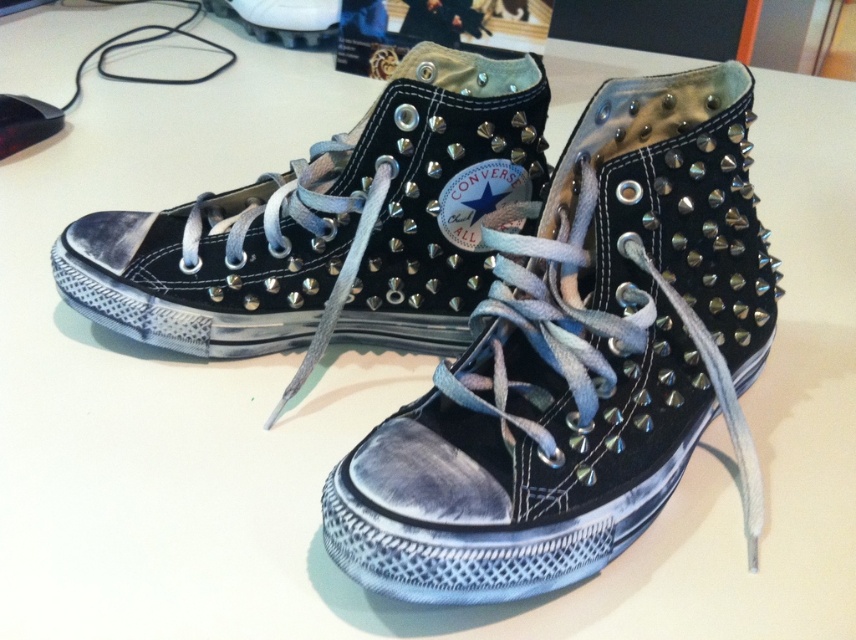
Question: Which point is closer to the camera?

Choices:
 (A) black leather converse at center
 (B) matte black sneakers at center

Answer: (A)

Question: Does black leather converse at center appear over matte black sneakers at center?

Choices:
 (A) no
 (B) yes

Answer: (A)

Question: Which of the following is the closest to the observer?

Choices:
 (A) (596, 547)
 (B) (308, 269)

Answer: (A)

Question: Is black leather converse at center to the right of matte black sneakers at center from the viewer's perspective?

Choices:
 (A) yes
 (B) no

Answer: (A)

Question: Can you confirm if black leather converse at center is wider than matte black sneakers at center?

Choices:
 (A) no
 (B) yes

Answer: (A)